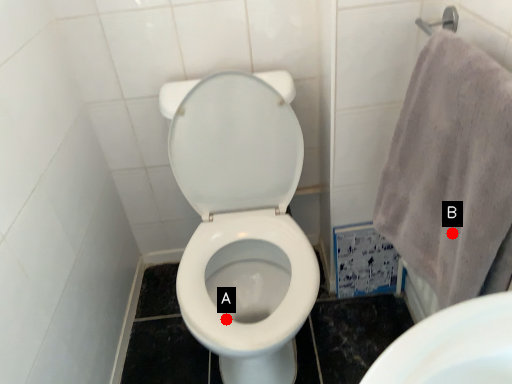
Question: Two points are circled on the image, labeled by A and B beside each circle. Which of the following is the closest to the observer?

Choices:
 (A) A is closer
 (B) B is closer

Answer: (B)